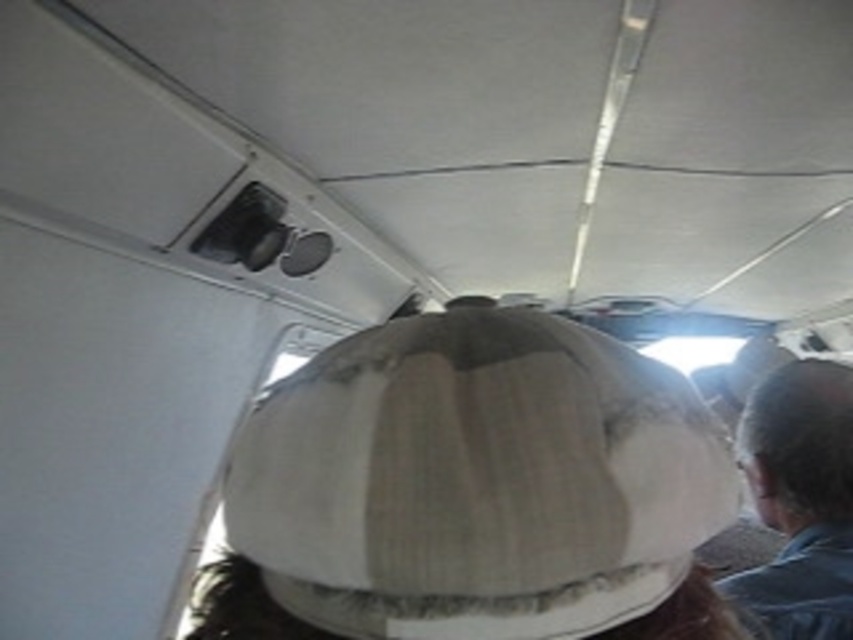
Is fuzzy beige baseball hat at center shorter than gray fabric hat at upper right?

Correct, fuzzy beige baseball hat at center is not as tall as gray fabric hat at upper right.

Is fuzzy beige baseball hat at center smaller than gray fabric hat at upper right?

Yes.

Which is behind, point (430, 602) or point (758, 566)?

Point (758, 566)

In order to click on fuzzy beige baseball hat at center in this screenshot , I will do `click(477, 481)`.